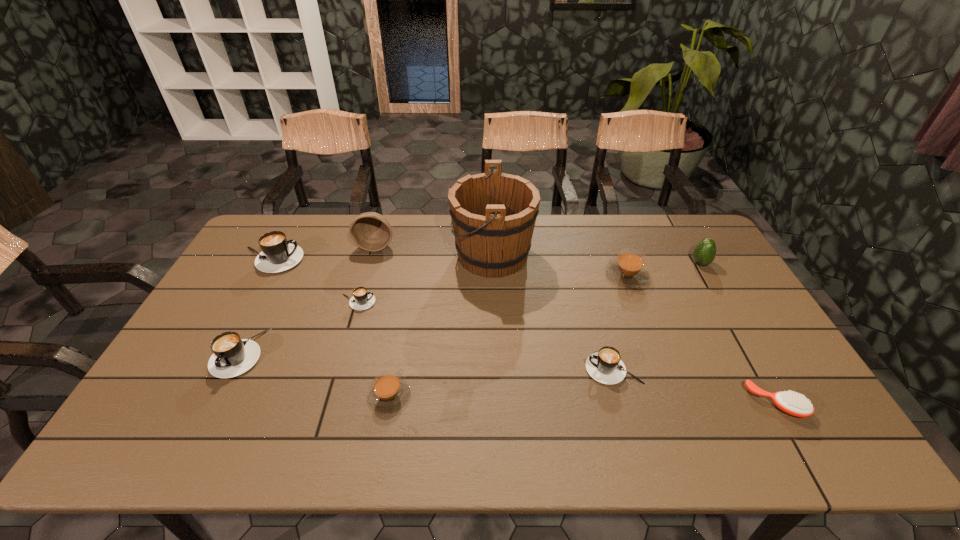
Locate an element on the screen. the sixth object from left to right is located at coordinates (493, 214).

The height and width of the screenshot is (540, 960). I want to click on wine bucket, so click(493, 214).

Identify the location of bowl. (371, 231).

Find the location of a particular element. avocado is located at coordinates (704, 253).

You are a GUI agent. You are given a task and a screenshot of the screen. Output one action in this format:
    pyautogui.click(x=<x>, y=<y>)
    Task: Click on the farthest black cappuccino
    This screenshot has height=540, width=960.
    Given the screenshot: What is the action you would take?
    pyautogui.click(x=278, y=254)

The width and height of the screenshot is (960, 540). What are the coordinates of `the right brown cappuccino` in the screenshot? It's located at (628, 270).

Image resolution: width=960 pixels, height=540 pixels. In order to click on the farther brown cappuccino in this screenshot , I will do `click(628, 270)`.

You are a GUI agent. You are given a task and a screenshot of the screen. Output one action in this format:
    pyautogui.click(x=<x>, y=<y>)
    Task: Click on the second biggest black cappuccino
    
    Given the screenshot: What is the action you would take?
    pyautogui.click(x=232, y=356)

You are a GUI agent. You are given a task and a screenshot of the screen. Output one action in this format:
    pyautogui.click(x=<x>, y=<y>)
    Task: Click on the third biggest black cappuccino
    This screenshot has width=960, height=540.
    Given the screenshot: What is the action you would take?
    pyautogui.click(x=605, y=366)

Where is `the fifth object from left to right`? Image resolution: width=960 pixels, height=540 pixels. the fifth object from left to right is located at coordinates (389, 393).